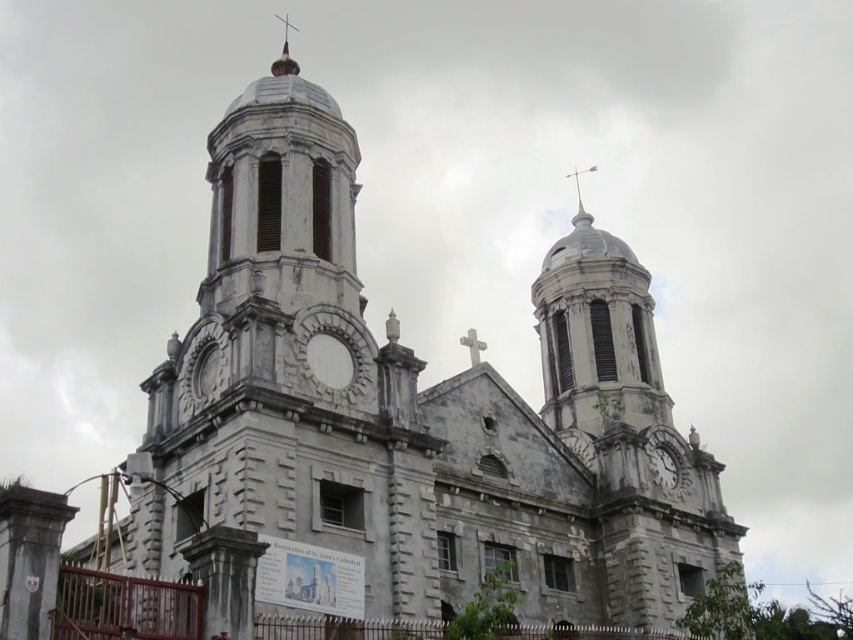
Describe the element at coordinates (596, 333) in the screenshot. I see `white stone dome at upper center` at that location.

Is white stone dome at upper center to the right of white stone spire at upper center from the viewer's perspective?

Incorrect, white stone dome at upper center is not on the right side of white stone spire at upper center.

Find the location of a particular element. The image size is (853, 640). white stone dome at upper center is located at coordinates (596, 333).

In the scene shown: Is gray stone clock tower at center wider than white stone spire at upper center?

Yes, gray stone clock tower at center is wider than white stone spire at upper center.

Can you confirm if gray stone clock tower at center is smaller than white stone spire at upper center?

Actually, gray stone clock tower at center might be larger than white stone spire at upper center.

Who is more forward, (314, 388) or (577, 209)?

Positioned in front is point (314, 388).

Locate an element on the screen. This screenshot has height=640, width=853. gray stone clock tower at center is located at coordinates (289, 369).

Does white stone clock at center appear on the left side of white stone spire at upper center?

No, white stone clock at center is not to the left of white stone spire at upper center.

Does point (663, 467) come farther from viewer compared to point (595, 170)?

No, it is not.

The width and height of the screenshot is (853, 640). What are the coordinates of `white stone clock at center` in the screenshot? It's located at (664, 467).

Locate an element on the screen. Image resolution: width=853 pixels, height=640 pixels. white stone clock at center is located at coordinates (664, 467).